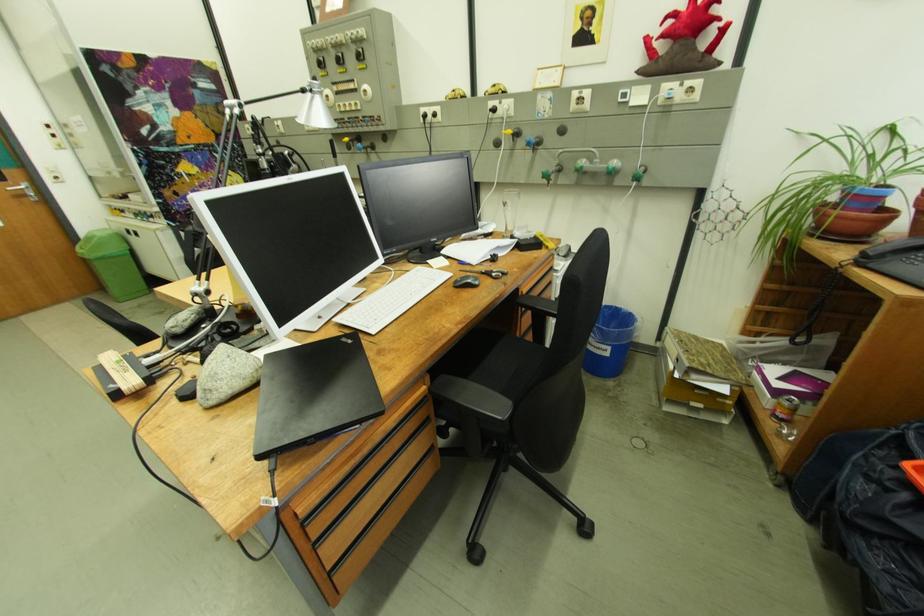
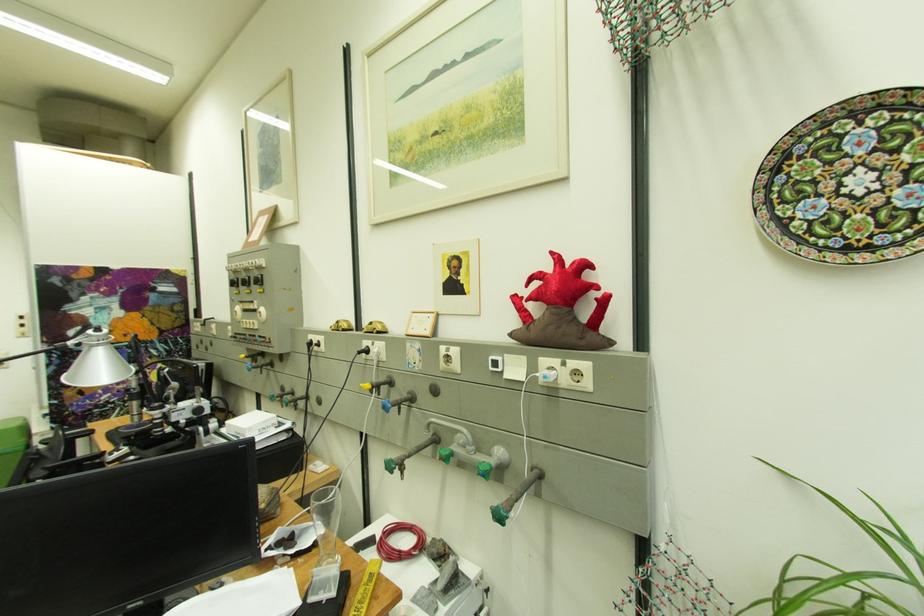
In the second image, find the point that corresponds to [570,175] in the first image.

(448, 447)